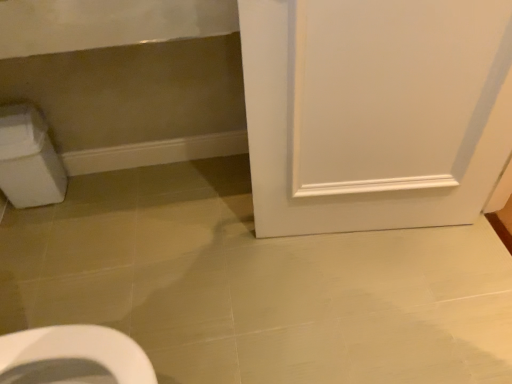
The height and width of the screenshot is (384, 512). What do you see at coordinates (374, 111) in the screenshot?
I see `white matte door at center` at bounding box center [374, 111].

In order to click on white matte door at center in this screenshot , I will do `click(374, 111)`.

Where is `white matte door at center`? The image size is (512, 384). white matte door at center is located at coordinates click(374, 111).